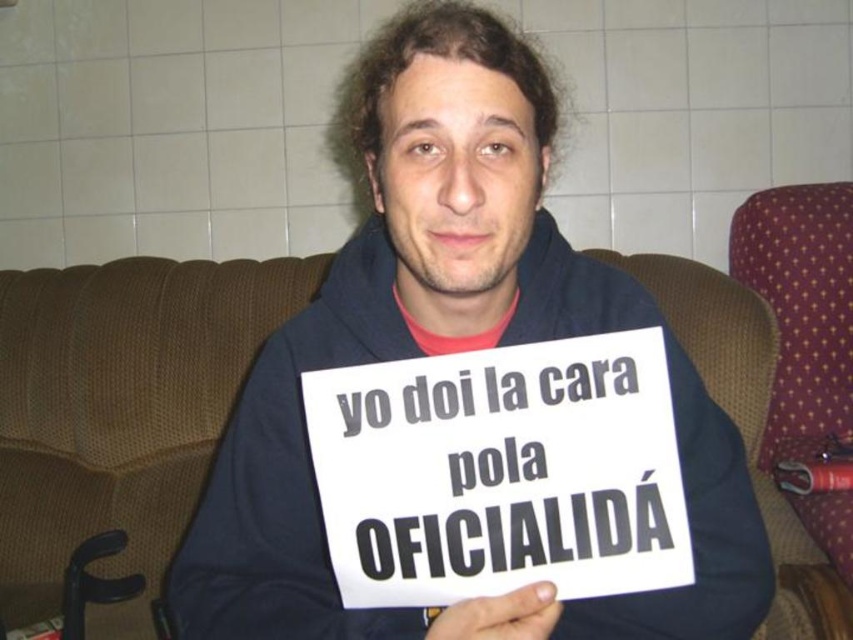
Question: Which point is farther to the camera?

Choices:
 (A) white paper sign at center
 (B) dark blue hoodie at center

Answer: (A)

Question: Does dark blue hoodie at center appear under white paper sign at center?

Choices:
 (A) no
 (B) yes

Answer: (A)

Question: Which of the following is the closest to the observer?

Choices:
 (A) (378, 524)
 (B) (303, 621)

Answer: (A)

Question: Does dark blue hoodie at center appear over white paper sign at center?

Choices:
 (A) no
 (B) yes

Answer: (B)

Question: From the image, what is the correct spatial relationship of dark blue hoodie at center in relation to white paper sign at center?

Choices:
 (A) above
 (B) below

Answer: (A)